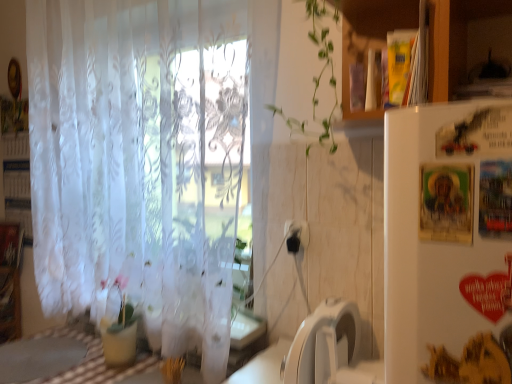
Question: Does translucent white curtain at left appear on the left side of checkered fabric table at lower left?

Choices:
 (A) no
 (B) yes

Answer: (A)

Question: Can you confirm if translucent white curtain at left is thinner than checkered fabric table at lower left?

Choices:
 (A) no
 (B) yes

Answer: (B)

Question: From the image's perspective, is translucent white curtain at left located above checkered fabric table at lower left?

Choices:
 (A) yes
 (B) no

Answer: (A)

Question: Is there a large distance between translucent white curtain at left and checkered fabric table at lower left?

Choices:
 (A) no
 (B) yes

Answer: (A)

Question: Does translucent white curtain at left have a greater height compared to checkered fabric table at lower left?

Choices:
 (A) no
 (B) yes

Answer: (B)

Question: In the image, is white plastic washing machine at lower center positioned in front of or behind translucent white curtain at left?

Choices:
 (A) front
 (B) behind

Answer: (A)

Question: Is white plastic washing machine at lower center wider or thinner than translucent white curtain at left?

Choices:
 (A) wide
 (B) thin

Answer: (A)

Question: In the image, is white plastic washing machine at lower center on the left side or the right side of translucent white curtain at left?

Choices:
 (A) right
 (B) left

Answer: (A)

Question: From a real-world perspective, is white plastic washing machine at lower center above or below translucent white curtain at left?

Choices:
 (A) below
 (B) above

Answer: (A)

Question: From the image's perspective, is white cardboard bookshelf at left positioned above or below translucent white curtain at left?

Choices:
 (A) above
 (B) below

Answer: (B)

Question: Is white cardboard bookshelf at left wider or thinner than translucent white curtain at left?

Choices:
 (A) wide
 (B) thin

Answer: (B)

Question: Is white cardboard bookshelf at left to the left or to the right of translucent white curtain at left in the image?

Choices:
 (A) right
 (B) left

Answer: (B)

Question: In terms of size, does white cardboard bookshelf at left appear bigger or smaller than translucent white curtain at left?

Choices:
 (A) big
 (B) small

Answer: (B)

Question: Would you say checkered fabric table at lower left is to the left or to the right of black plastic electric outlet at center in the picture?

Choices:
 (A) left
 (B) right

Answer: (A)

Question: Considering their positions, is checkered fabric table at lower left located in front of or behind black plastic electric outlet at center?

Choices:
 (A) behind
 (B) front

Answer: (B)